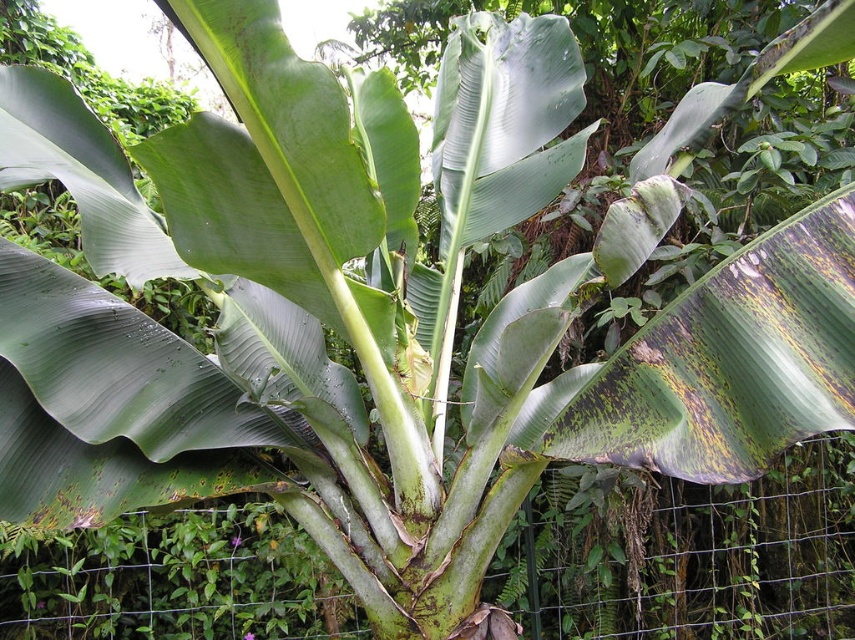
Between wire mesh fence at center and yellow-green spotted leaf at center-right, which one appears on the right side from the viewer's perspective?

wire mesh fence at center is more to the right.

Does wire mesh fence at center have a greater height compared to yellow-green spotted leaf at center-right?

Correct, wire mesh fence at center is much taller as yellow-green spotted leaf at center-right.

Locate an element on the screen. The width and height of the screenshot is (855, 640). wire mesh fence at center is located at coordinates (687, 554).

The image size is (855, 640). In order to click on wire mesh fence at center in this screenshot , I will do `click(687, 554)`.

The image size is (855, 640). What do you see at coordinates (687, 554) in the screenshot?
I see `wire mesh fence at center` at bounding box center [687, 554].

Who is positioned more to the left, wire mesh fence at center or green matte leaf at upper left?

Positioned to the left is green matte leaf at upper left.

You are a GUI agent. You are given a task and a screenshot of the screen. Output one action in this format:
    pyautogui.click(x=<x>, y=<y>)
    Task: Click on the wire mesh fence at center
    This screenshot has height=640, width=855.
    Given the screenshot: What is the action you would take?
    pyautogui.click(x=687, y=554)

Does yellow-green spotted leaf at center-right lie behind green smooth leaf at center?

That is True.

Locate an element on the screen. This screenshot has width=855, height=640. yellow-green spotted leaf at center-right is located at coordinates (732, 360).

Which is in front, point (670, 360) or point (310, 80)?

Point (310, 80) is more forward.

Where is `yellow-green spotted leaf at center-right`? The height and width of the screenshot is (640, 855). yellow-green spotted leaf at center-right is located at coordinates (732, 360).